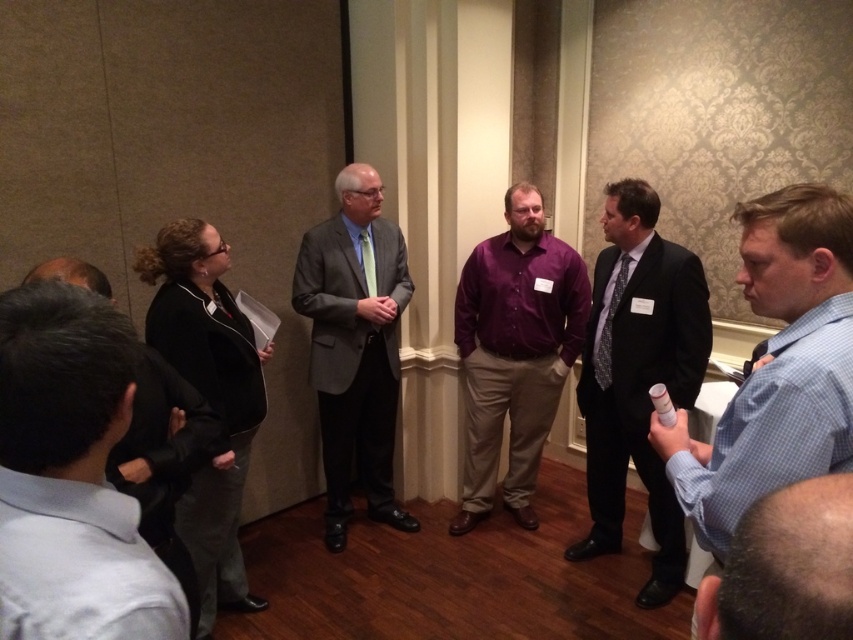
Which is behind, point (833, 193) or point (363, 456)?

Point (363, 456)

Between blue checkered shirt at right and matte gray suit at center, which one is positioned higher?

Positioned higher is blue checkered shirt at right.

Which is behind, point (843, 221) or point (315, 234)?

The point (315, 234) is behind.

Locate an element on the screen. blue checkered shirt at right is located at coordinates (776, 365).

Does blue checkered shirt at right have a greater width compared to matte black suit at center?

No.

Where is `blue checkered shirt at right`? This screenshot has height=640, width=853. blue checkered shirt at right is located at coordinates (776, 365).

Locate an element on the screen. blue checkered shirt at right is located at coordinates (776, 365).

Can you confirm if matte black suit at center is shorter than light blue checkered shirt at lower right?

No.

Is matte black suit at center bigger than light blue checkered shirt at lower right?

Yes.

Is point (646, 221) farther from viewer compared to point (769, 513)?

Yes, point (646, 221) is behind point (769, 513).

Find the location of a particular element. This screenshot has height=640, width=853. matte black suit at center is located at coordinates (637, 376).